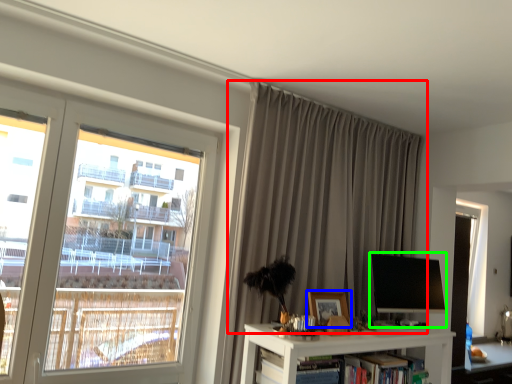
Question: Which is nearer to the curtain (highlighted by a red box)? picture frame (highlighted by a blue box) or computer monitor (highlighted by a green box).

Choices:
 (A) picture frame
 (B) computer monitor

Answer: (B)